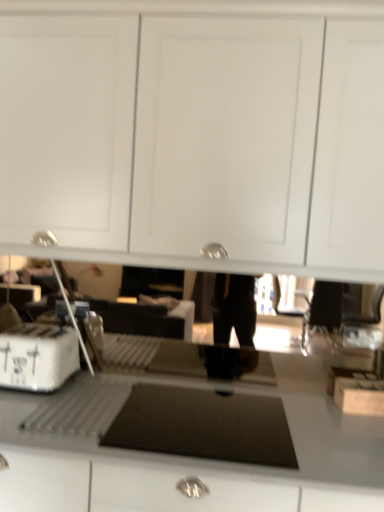
You are a GUI agent. You are given a task and a screenshot of the screen. Output one action in this format:
    pyautogui.click(x=<x>, y=<y>)
    Task: Click on the smooth gray countertop at center
    
    Given the screenshot: What is the action you would take?
    pyautogui.click(x=192, y=458)

Image resolution: width=384 pixels, height=512 pixels. Describe the element at coordinates (192, 458) in the screenshot. I see `smooth gray countertop at center` at that location.

The image size is (384, 512). What do you see at coordinates (38, 357) in the screenshot?
I see `white cardboard box at left` at bounding box center [38, 357].

Find the location of `white cardboard box at left`. white cardboard box at left is located at coordinates (38, 357).

Measure the distance between point (21, 346) and camera.

Point (21, 346) is 1.62 meters away from camera.

Find the location of a particular element. smooth gray countertop at center is located at coordinates (192, 458).

Between smooth gray countertop at center and white cardboard box at left, which one appears on the right side from the viewer's perspective?

Positioned to the right is smooth gray countertop at center.

In the scene shown: Between smooth gray countertop at center and white cardboard box at left, which one is positioned in front?

smooth gray countertop at center is closer to the camera.

Does point (227, 478) come in front of point (23, 378)?

Yes, point (227, 478) is closer to viewer.

From the image's perspective, who appears lower, smooth gray countertop at center or white cardboard box at left?

smooth gray countertop at center is shown below in the image.

From a real-world perspective, which is physically above, smooth gray countertop at center or white cardboard box at left?

white cardboard box at left.

In the scene shown: Looking at their sizes, would you say smooth gray countertop at center is wider or thinner than white cardboard box at left?

smooth gray countertop at center is wider than white cardboard box at left.

Between smooth gray countertop at center and white cardboard box at left, which one has less height?

Standing shorter between the two is white cardboard box at left.

Is smooth gray countertop at center smaller than white cardboard box at left?

No, smooth gray countertop at center is not smaller than white cardboard box at left.

Is smooth gray countertop at center inside the boundaries of white cardboard box at left, or outside?

smooth gray countertop at center exists outside the volume of white cardboard box at left.

Looking at this image, is smooth gray countertop at center far from white cardboard box at left?

smooth gray countertop at center is near white cardboard box at left, not far away.

Is smooth gray countertop at center oriented away from white cardboard box at left?

That's not correct — smooth gray countertop at center is not looking away from white cardboard box at left.

How different are the orientations of smooth gray countertop at center and white cardboard box at left in degrees?

The angle between the facing direction of smooth gray countertop at center and the facing direction of white cardboard box at left is 0.000537 degrees.

I want to click on countertop in front of the white cardboard box at left, so (192, 458).

From the picture: Would you say white cardboard box at left is to the left or to the right of smooth gray countertop at center in the picture?

white cardboard box at left is positioned on smooth gray countertop at center's left side.

Is white cardboard box at left in front of smooth gray countertop at center?

No, white cardboard box at left is behind smooth gray countertop at center.

Consider the image. Which is closer, (53,342) or (322,496)?

Point (53,342) is farther from the camera than point (322,496).

From the picture: From the image's perspective, is white cardboard box at left above or below smooth gray countertop at center?

Clearly, from the image's perspective, white cardboard box at left is above smooth gray countertop at center.

From a real-world perspective, between white cardboard box at left and smooth gray countertop at center, who is vertically lower?

In real-world perspective, smooth gray countertop at center is lower.

Looking at this image, which object is wider, white cardboard box at left or smooth gray countertop at center?

Wider between the two is smooth gray countertop at center.

From their relative heights in the image, would you say white cardboard box at left is taller or shorter than smooth gray countertop at center?

Clearly, white cardboard box at left is shorter compared to smooth gray countertop at center.

Considering the sizes of objects white cardboard box at left and smooth gray countertop at center in the image provided, who is bigger, white cardboard box at left or smooth gray countertop at center?

smooth gray countertop at center.

Is white cardboard box at left inside or outside of smooth gray countertop at center?

white cardboard box at left is spatially situated outside smooth gray countertop at center.

Is white cardboard box at left beside smooth gray countertop at center?

white cardboard box at left and smooth gray countertop at center are not in contact.

Is smooth gray countertop at center at the back of white cardboard box at left?

No, white cardboard box at left is not facing away from smooth gray countertop at center.

How different are the orientations of white cardboard box at left and smooth gray countertop at center in degrees?

The angle between the facing direction of white cardboard box at left and the facing direction of smooth gray countertop at center is 0.000537 degrees.

Locate an element on the screen. home appliance on the left of smooth gray countertop at center is located at coordinates (38, 357).

The height and width of the screenshot is (512, 384). Identify the location of home appliance lying above the smooth gray countertop at center (from the image's perspective). (38, 357).

Where is `countertop that is on the right side of white cardboard box at left`? The image size is (384, 512). countertop that is on the right side of white cardboard box at left is located at coordinates (192, 458).